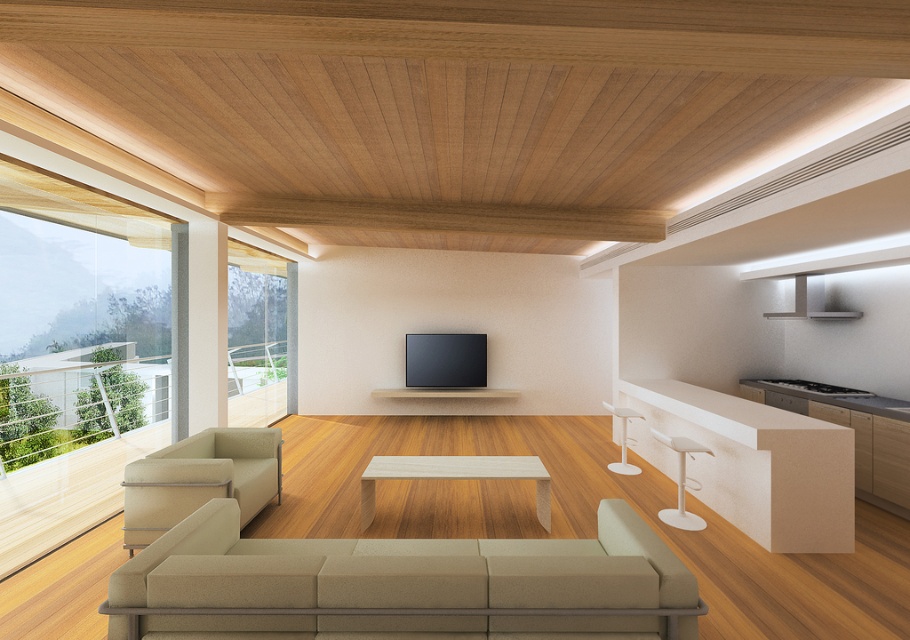
Question: Which of the following is the closest to the observer?

Choices:
 (A) white plastic bar stool at right
 (B) white matte bar counter at right

Answer: (B)

Question: Can you confirm if white matte bar counter at right is thinner than light wood/texture coffee table at center?

Choices:
 (A) no
 (B) yes

Answer: (B)

Question: Estimate the real-world distances between objects in this image. Which object is closer to the white glossy bar stool at right?

Choices:
 (A) light wood/texture coffee table at center
 (B) white plastic bar stool at right
 (C) beige fabric armchair at left
 (D) white matte bar counter at right

Answer: (D)

Question: Is white matte bar counter at right thinner than beige fabric armchair at left?

Choices:
 (A) no
 (B) yes

Answer: (A)

Question: Which of these objects is positioned closest to the light wood/texture coffee table at center?

Choices:
 (A) beige fabric armchair at left
 (B) white glossy bar stool at right

Answer: (A)

Question: Can you confirm if white matte bar counter at right is wider than light wood/texture coffee table at center?

Choices:
 (A) no
 (B) yes

Answer: (A)